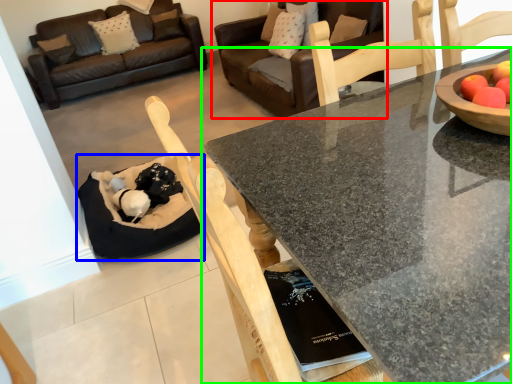
Question: Based on their relative distances, which object is nearer to studio couch (highlighted by a red box)? Choose from cat bed (highlighted by a blue box) and coffee table (highlighted by a green box).

Choices:
 (A) cat bed
 (B) coffee table

Answer: (A)